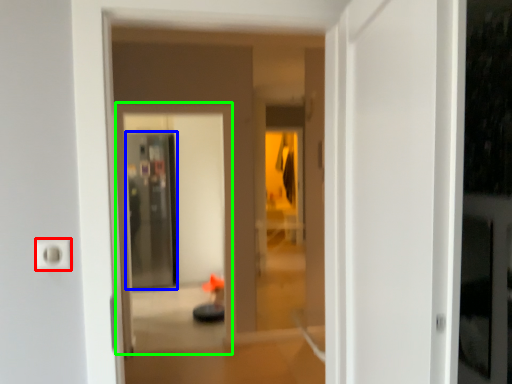
Question: Considering the real-world distances, which object is farthest from electric outlet (highlighted by a red box)? screen door (highlighted by a blue box) or screen door (highlighted by a green box)?

Choices:
 (A) screen door
 (B) screen door

Answer: (A)